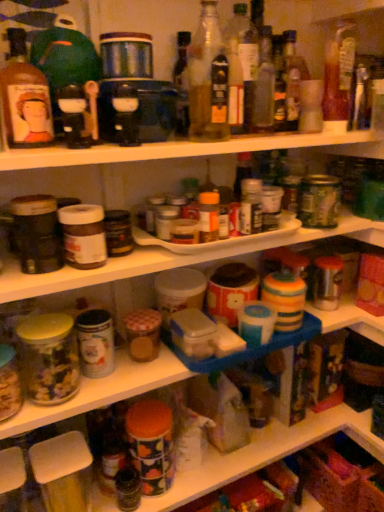
Locate an element on the screen. The image size is (384, 512). translucent glass bottle at upper center, acting as the fifth bottle starting from the left is located at coordinates (293, 78).

I want to click on translucent glass jar at left, so click(x=49, y=358).

How much space does matte glass bottle at upper left, placed as the first bottle when sorted from left to right, occupy vertically?

8.97 inches.

Measure the distance between point [195,70] and camera.

Point [195,70] is 33.07 inches away from camera.

Measure the distance between point [333,53] and camera.

The depth of point [333,53] is 94.40 centimeters.

What is the approximate height of translucent glass bottle at upper center, positioned as the fourth bottle in right-to-left order?

The height of translucent glass bottle at upper center, positioned as the fourth bottle in right-to-left order, is 8.59 inches.

Image resolution: width=384 pixels, height=512 pixels. In order to click on matte black blender at upper center in this screenshot , I will do `click(133, 91)`.

Identify the location of the 5th bottle below the translucent glass bottle at center, which is the fourth bottle from left to right (from the image's perspective). Image resolution: width=384 pixels, height=512 pixels. (24, 97).

Can you tell me how much matte glass bottle at upper left, placed as the first bottle when sorted from left to right, and translucent glass bottle at center, placed as the third bottle when sorted from right to left, differ in facing direction?

3.51 degrees.

Which is more to the left, matte glass bottle at upper left, placed as the first bottle when sorted from left to right, or translucent glass bottle at center, placed as the third bottle when sorted from right to left?

matte glass bottle at upper left, placed as the first bottle when sorted from left to right.

Between matte glass bottle at upper left, the 6th bottle in the right-to-left sequence, and translucent glass bottle at center, which is the fourth bottle from left to right, which one is positioned in front?

matte glass bottle at upper left, the 6th bottle in the right-to-left sequence, is closer to the camera.

In the scene shown: From the image's perspective, which one is positioned higher, translucent glass bottle at upper center, acting as the fifth bottle starting from the left, or translucent glass bottle at center, which is the fourth bottle from left to right?

translucent glass bottle at center, which is the fourth bottle from left to right, appears higher in the image.

From the translucent glass bottle at upper center, acting as the fifth bottle starting from the left, count 1st bottles forward and point to it. Please provide its 2D coordinates.

[(250, 62)]

From the picture: Between translucent glass bottle at upper center, acting as the fifth bottle starting from the left, and translucent glass bottle at center, placed as the third bottle when sorted from right to left, which one has larger width?

translucent glass bottle at upper center, acting as the fifth bottle starting from the left, is wider.

Who is shorter, translucent glass bottle at upper center, the 5th bottle viewed from the right, or translucent glass bottle at upper right, the sixth bottle when ordered from left to right?

Standing shorter between the two is translucent glass bottle at upper right, the sixth bottle when ordered from left to right.

Is translucent glass bottle at upper center, placed as the second bottle when sorted from left to right, bigger than translucent glass bottle at upper right, which is the first bottle in right-to-left order?

No.

From a real-world perspective, between translucent glass bottle at upper center, placed as the second bottle when sorted from left to right, and translucent glass bottle at upper right, the sixth bottle when ordered from left to right, who is vertically higher?

In real-world perspective, translucent glass bottle at upper center, placed as the second bottle when sorted from left to right, is above.

Considering the relative positions of translucent glass bottle at upper center, placed as the second bottle when sorted from left to right, and translucent glass bottle at upper right, the sixth bottle when ordered from left to right, in the image provided, is translucent glass bottle at upper center, placed as the second bottle when sorted from left to right, to the left of translucent glass bottle at upper right, the sixth bottle when ordered from left to right, from the viewer's perspective?

Indeed, translucent glass bottle at upper center, placed as the second bottle when sorted from left to right, is positioned on the left side of translucent glass bottle at upper right, the sixth bottle when ordered from left to right.

Locate an element on the screen. This screenshot has height=512, width=384. the 4th bottle below the translucent glass bottle at center, which is the fourth bottle from left to right (from the image's perspective) is located at coordinates (208, 78).

From a real-world perspective, does translucent glass bottle at center, which is the fourth bottle from left to right, stand above translucent glass bottle at upper center, the 5th bottle viewed from the right?

Yes, from a real-world perspective, translucent glass bottle at center, which is the fourth bottle from left to right, is on top of translucent glass bottle at upper center, the 5th bottle viewed from the right.

Can you confirm if translucent glass bottle at center, which is the fourth bottle from left to right, is positioned to the left of translucent glass bottle at upper center, the 5th bottle viewed from the right?

No, translucent glass bottle at center, which is the fourth bottle from left to right, is not to the left of translucent glass bottle at upper center, the 5th bottle viewed from the right.

Considering the sizes of translucent glass bottle at center, placed as the third bottle when sorted from right to left, and translucent glass bottle at upper center, the 5th bottle viewed from the right, in the image, is translucent glass bottle at center, placed as the third bottle when sorted from right to left, wider or thinner than translucent glass bottle at upper center, the 5th bottle viewed from the right,?

Clearly, translucent glass bottle at center, placed as the third bottle when sorted from right to left, has less width compared to translucent glass bottle at upper center, the 5th bottle viewed from the right.

Which is behind, point (46, 100) or point (110, 65)?

The point (110, 65) is more distant.

From a real-world perspective, is matte glass bottle at upper left, the 6th bottle in the right-to-left sequence, physically located above or below matte black blender at upper center?

In terms of real-world spatial position, matte glass bottle at upper left, the 6th bottle in the right-to-left sequence, is above matte black blender at upper center.

From the image's perspective, is matte glass bottle at upper left, the 6th bottle in the right-to-left sequence, above or below matte black blender at upper center?

Based on their image positions, matte glass bottle at upper left, the 6th bottle in the right-to-left sequence, is located beneath matte black blender at upper center.

From the picture: Measure the distance between matte glass bottle at upper left, placed as the first bottle when sorted from left to right, and matte black blender at upper center.

matte glass bottle at upper left, placed as the first bottle when sorted from left to right, and matte black blender at upper center are 5.94 inches apart from each other.

In the scene shown: Between translucent glass bottle at upper center, the 5th bottle viewed from the right, and matte glass bottle at upper left, placed as the first bottle when sorted from left to right, which one has larger size?

Bigger between the two is translucent glass bottle at upper center, the 5th bottle viewed from the right.

Is translucent glass bottle at upper center, placed as the second bottle when sorted from left to right, facing away from matte glass bottle at upper left, the 6th bottle in the right-to-left sequence?

No, translucent glass bottle at upper center, placed as the second bottle when sorted from left to right,'s orientation is not away from matte glass bottle at upper left, the 6th bottle in the right-to-left sequence.

Is translucent glass bottle at upper center, the 5th bottle viewed from the right, not within matte glass bottle at upper left, the 6th bottle in the right-to-left sequence?

That's correct, translucent glass bottle at upper center, the 5th bottle viewed from the right, is outside of matte glass bottle at upper left, the 6th bottle in the right-to-left sequence.

Is translucent glass bottle at upper center, the 5th bottle viewed from the right, completely or partially outside of matte black blender at upper center?

Absolutely, translucent glass bottle at upper center, the 5th bottle viewed from the right, is external to matte black blender at upper center.

Is translucent glass bottle at upper center, the 5th bottle viewed from the right, bigger or smaller than matte black blender at upper center?

translucent glass bottle at upper center, the 5th bottle viewed from the right, is smaller than matte black blender at upper center.

Does translucent glass bottle at upper center, placed as the second bottle when sorted from left to right, appear on the right side of matte black blender at upper center?

Yes.

There is a translucent glass bottle at center, which is the fourth bottle from left to right. Where is `the 5th bottle below it (from the image's perspective)`? The image size is (384, 512). the 5th bottle below it (from the image's perspective) is located at coordinates (24, 97).

You are a GUI agent. You are given a task and a screenshot of the screen. Output one action in this format:
    pyautogui.click(x=<x>, y=<y>)
    Task: Click on the 1st bottle to the left when counting from the translucent glass bottle at upper center, which is the second bottle in right-to-left order
    
    Given the screenshot: What is the action you would take?
    pos(250,62)

Consider the image. Which object lies further to the anchor point matte glass bottle at upper left, the 6th bottle in the right-to-left sequence, translucent glass jar at left or translucent glass bottle at upper right, which is the first bottle in right-to-left order?

translucent glass bottle at upper right, which is the first bottle in right-to-left order, is further to matte glass bottle at upper left, the 6th bottle in the right-to-left sequence.

When comparing their distances from matte glass bottle at upper left, the 6th bottle in the right-to-left sequence, does translucent glass bottle at upper right, the sixth bottle when ordered from left to right, or translucent glass jar at left seem closer?

translucent glass jar at left.

Which object lies nearer to the anchor point translucent glass bottle at upper center, the 5th bottle viewed from the right, translucent glass bottle at upper center, positioned as the fourth bottle in right-to-left order, or translucent glass jar at left?

translucent glass bottle at upper center, positioned as the fourth bottle in right-to-left order.

From the image, which object appears to be farther from matte black blender at upper center, translucent glass bottle at upper center, the third bottle in the left-to-right sequence, or translucent glass bottle at upper center, which is the second bottle in right-to-left order?

Among the two, translucent glass bottle at upper center, which is the second bottle in right-to-left order, is located further to matte black blender at upper center.

Looking at the image, which one is located closer to translucent glass bottle at upper center, which is the second bottle in right-to-left order, translucent glass bottle at upper center, the third bottle in the left-to-right sequence, or matte glass bottle at upper left, placed as the first bottle when sorted from left to right?

The object closer to translucent glass bottle at upper center, which is the second bottle in right-to-left order, is translucent glass bottle at upper center, the third bottle in the left-to-right sequence.

Considering their positions, is translucent glass bottle at center, which is the fourth bottle from left to right, positioned further to matte black blender at upper center than translucent glass bottle at upper center, placed as the second bottle when sorted from left to right?

translucent glass bottle at center, which is the fourth bottle from left to right.

When comparing their distances from matte black blender at upper center, does translucent glass bottle at upper center, which is the second bottle in right-to-left order, or translucent glass bottle at upper center, positioned as the fourth bottle in right-to-left order, seem further?

translucent glass bottle at upper center, which is the second bottle in right-to-left order.

Estimate the real-world distances between objects in this image. Which object is closer to translucent glass bottle at upper center, positioned as the fourth bottle in right-to-left order, translucent glass bottle at upper right, the sixth bottle when ordered from left to right, or translucent glass jar at left?

The object closer to translucent glass bottle at upper center, positioned as the fourth bottle in right-to-left order, is translucent glass bottle at upper right, the sixth bottle when ordered from left to right.

The height and width of the screenshot is (512, 384). What are the coordinates of `appliance situated between matte glass bottle at upper left, placed as the first bottle when sorted from left to right, and translucent glass bottle at center, which is the fourth bottle from left to right, from left to right` in the screenshot? It's located at (133, 91).

At what (x,y) coordinates should I click in order to perform the action: click on bottle between matte glass bottle at upper left, placed as the first bottle when sorted from left to right, and translucent glass bottle at upper center, the third bottle in the left-to-right sequence, from left to right. Please return your answer as a coordinate pair (x, y). The width and height of the screenshot is (384, 512). Looking at the image, I should click on (208, 78).

Where is `bottle situated between translucent glass bottle at center, placed as the third bottle when sorted from right to left, and translucent glass bottle at upper right, which is the first bottle in right-to-left order, from left to right`? bottle situated between translucent glass bottle at center, placed as the third bottle when sorted from right to left, and translucent glass bottle at upper right, which is the first bottle in right-to-left order, from left to right is located at coordinates (293, 78).

The image size is (384, 512). In order to click on appliance between matte glass bottle at upper left, the 6th bottle in the right-to-left sequence, and translucent glass bottle at upper center, acting as the fifth bottle starting from the left, from left to right in this screenshot , I will do `click(133, 91)`.